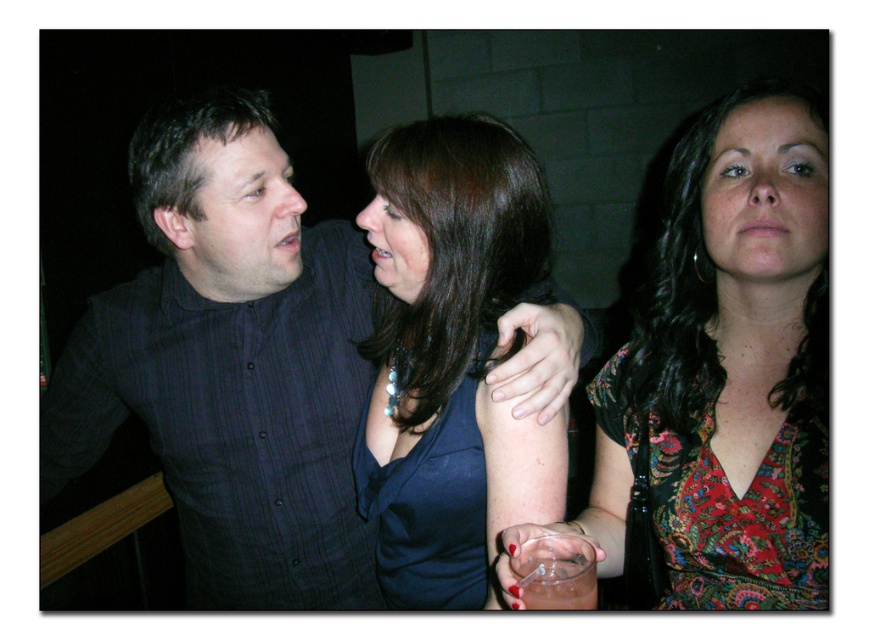
You are at a social event and see the dark blue shirt at center and the clear plastic glass at lower center. Which object is positioned to the right side of the other?

The clear plastic glass at lower center is positioned to the right of the dark blue shirt at center.

You are a bartender who needs to choose between the clear plastic glass at lower center and the clear glass at lower center for a customer who prefers a drink that requires a sturdy container. Which glass should you choose?

The clear plastic glass at lower center is wider than the clear glass at lower center, so it is more durable and suitable for a customer who prefers a sturdy container.